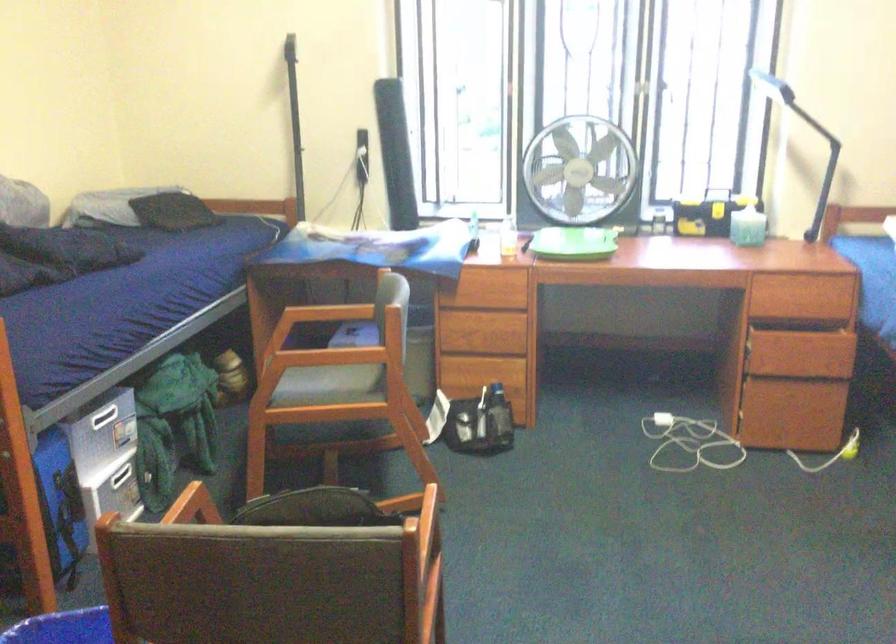
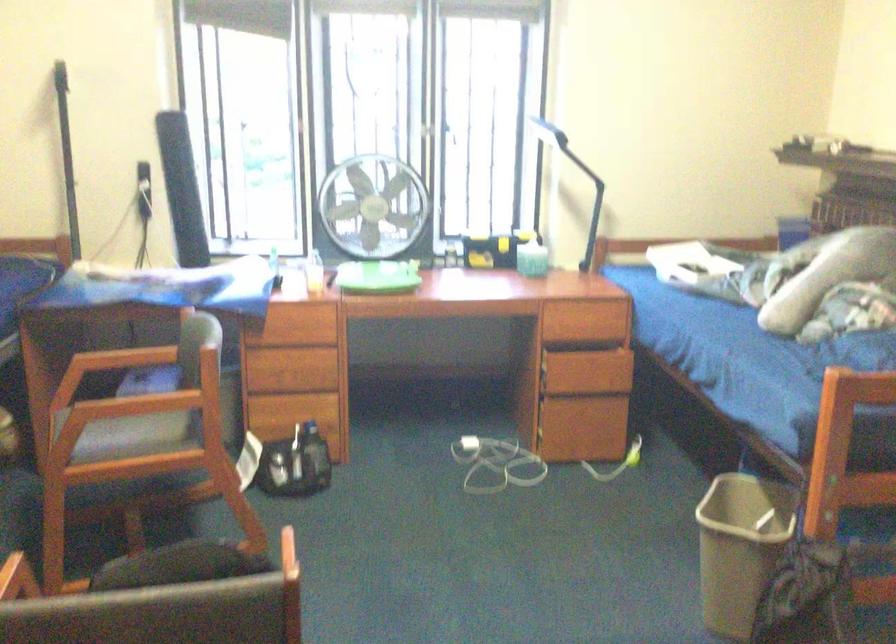
Question: The images are taken continuously from a first-person perspective. In which direction is your viewpoint rotating?

Choices:
 (A) Left
 (B) Right
 (C) Up
 (D) Down

Answer: (B)